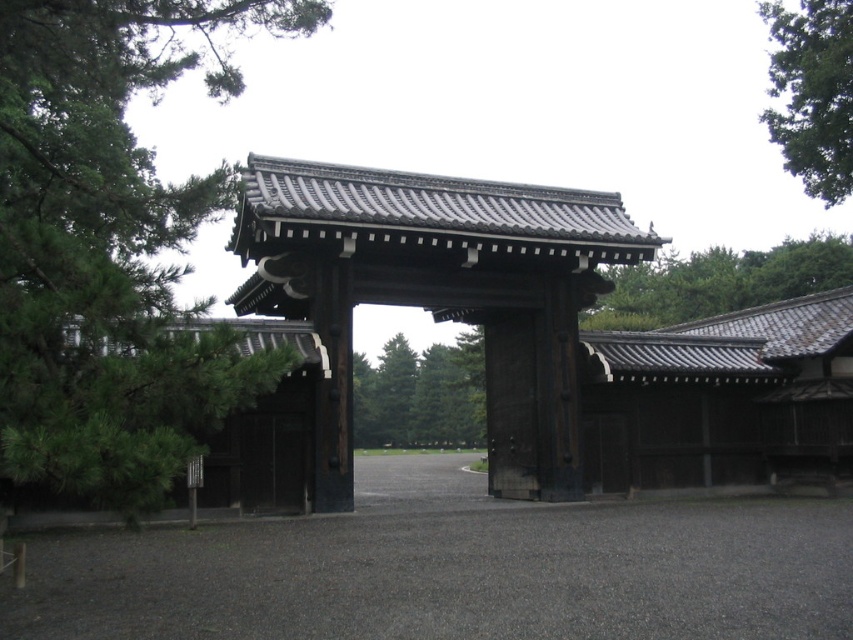
Does black wood gate at center appear under green shingled roof at upper center?

Correct, black wood gate at center is located below green shingled roof at upper center.

Does point (550, 196) lie behind point (676, 264)?

That is False.

The width and height of the screenshot is (853, 640). What are the coordinates of `black wood gate at center` in the screenshot? It's located at (439, 294).

Who is shorter, green leafy tree at left or green shingled roof at upper center?

green shingled roof at upper center

Can you confirm if green leafy tree at left is positioned to the left of green shingled roof at upper center?

Indeed, green leafy tree at left is positioned on the left side of green shingled roof at upper center.

Who is more forward, [189,60] or [833,259]?

Point [189,60] is in front.

The width and height of the screenshot is (853, 640). What are the coordinates of `green leafy tree at left` in the screenshot? It's located at (108, 246).

The height and width of the screenshot is (640, 853). Describe the element at coordinates (718, 282) in the screenshot. I see `green shingled roof at upper center` at that location.

Where is `green shingled roof at upper center`? The width and height of the screenshot is (853, 640). green shingled roof at upper center is located at coordinates (718, 282).